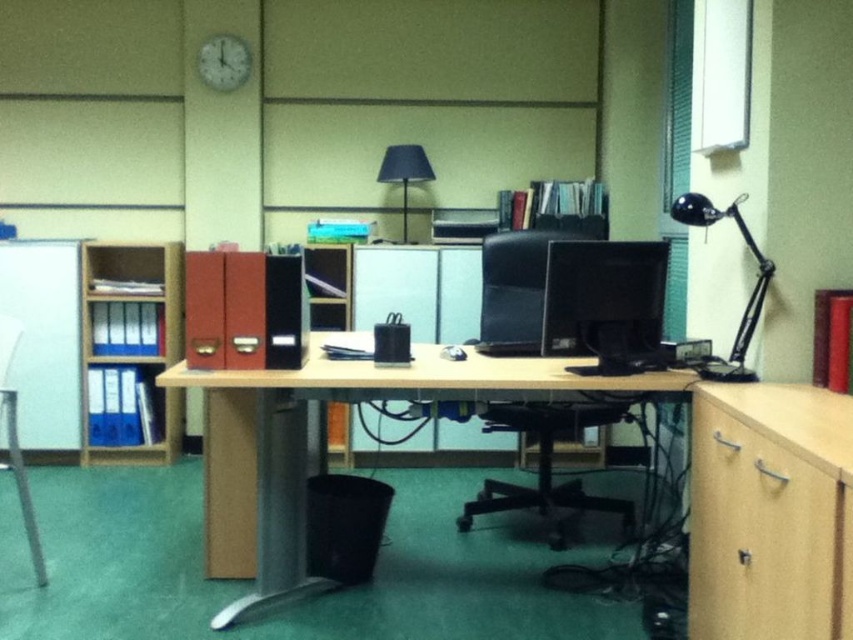
Question: Does wooden desk at center appear under matte black monitor at center?

Choices:
 (A) no
 (B) yes

Answer: (B)

Question: Which point is farther from the camera taking this photo?

Choices:
 (A) (216, 449)
 (B) (612, 506)
 (C) (741, 339)

Answer: (B)

Question: Is wooden/file cabinet at right positioned behind black metal desk lamp at upper right?

Choices:
 (A) yes
 (B) no

Answer: (B)

Question: Which point is farther to the camera?

Choices:
 (A) (125, 349)
 (B) (296, 572)

Answer: (A)

Question: Considering the real-world distances, which object is farthest from the white plastic clock at upper center?

Choices:
 (A) matte black chair at center
 (B) matte black monitor at center

Answer: (B)

Question: Can you confirm if wooden/file cabinet at right is wider than black plastic swivel chair at center?

Choices:
 (A) no
 (B) yes

Answer: (A)